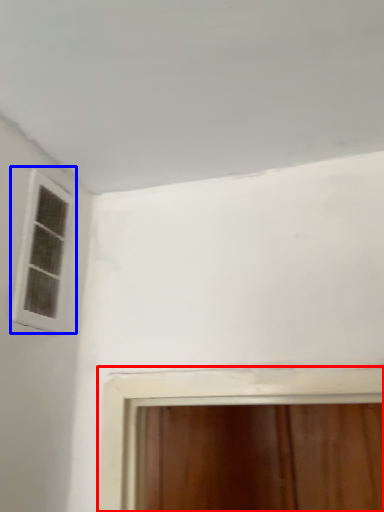
Question: Among these objects, which one is farthest to the camera, window (highlighted by a red box) or window (highlighted by a blue box)?

Choices:
 (A) window
 (B) window

Answer: (A)